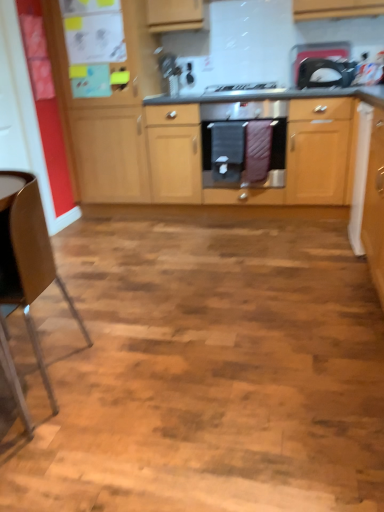
Question: Is white glossy microwave at upper right surrounded by wooden cabinets at center?

Choices:
 (A) yes
 (B) no

Answer: (B)

Question: From a real-world perspective, is wooden cabinets at center on top of white glossy microwave at upper right?

Choices:
 (A) no
 (B) yes

Answer: (A)

Question: Does wooden cabinets at center appear on the left side of white glossy microwave at upper right?

Choices:
 (A) no
 (B) yes

Answer: (B)

Question: Considering the relative positions of wooden cabinets at center and white glossy microwave at upper right in the image provided, is wooden cabinets at center in front of white glossy microwave at upper right?

Choices:
 (A) yes
 (B) no

Answer: (A)

Question: Is wooden cabinets at center oriented away from white glossy microwave at upper right?

Choices:
 (A) yes
 (B) no

Answer: (B)

Question: Is wooden cabinets at center wider than white glossy microwave at upper right?

Choices:
 (A) yes
 (B) no

Answer: (A)

Question: Is the position of black matte gas stove at center less distant than that of wooden cabinets at center?

Choices:
 (A) no
 (B) yes

Answer: (A)

Question: Considering the relative sizes of black matte gas stove at center and wooden cabinets at center in the image provided, is black matte gas stove at center bigger than wooden cabinets at center?

Choices:
 (A) yes
 (B) no

Answer: (B)

Question: Does black matte gas stove at center turn towards wooden cabinets at center?

Choices:
 (A) no
 (B) yes

Answer: (A)

Question: Is black matte gas stove at center at the right side of wooden cabinets at center?

Choices:
 (A) yes
 (B) no

Answer: (B)

Question: Is black matte gas stove at center outside of wooden cabinets at center?

Choices:
 (A) no
 (B) yes

Answer: (B)

Question: Is black matte gas stove at center wider than wooden cabinets at center?

Choices:
 (A) yes
 (B) no

Answer: (B)

Question: Is black fabric oven mitts at center outside white glossy microwave at upper right?

Choices:
 (A) yes
 (B) no

Answer: (A)